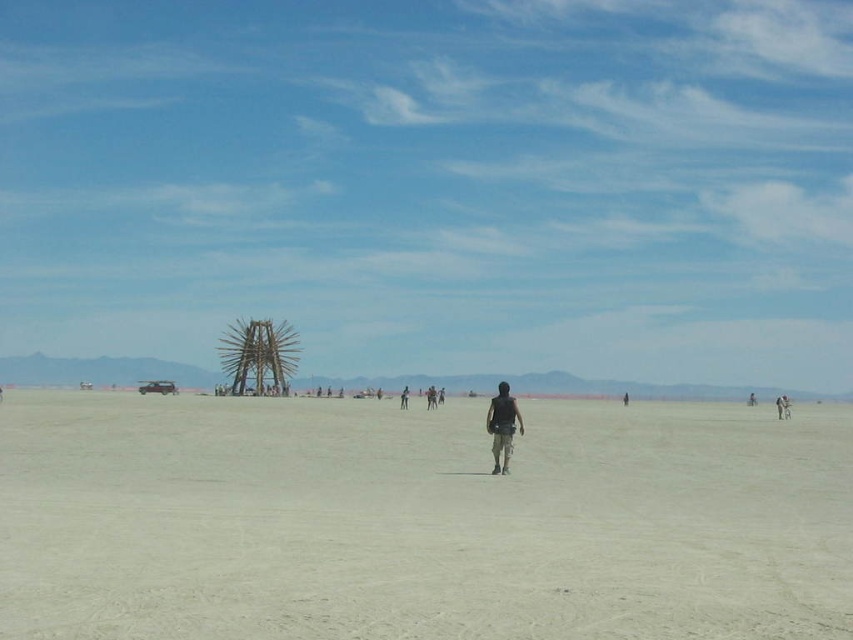
Based on the scene description, where is the point located at coordinates [419,520]?

The point at coordinates [419,520] is located on the light beige sand at center.